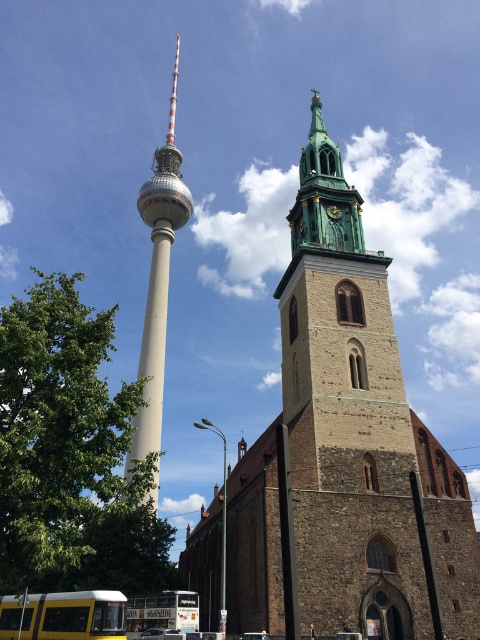
Question: Considering the relative positions of brown stone church at center and white concrete spire at center in the image provided, where is brown stone church at center located with respect to white concrete spire at center?

Choices:
 (A) right
 (B) left

Answer: (A)

Question: Can you confirm if brown stone church at center is thinner than white concrete spire at center?

Choices:
 (A) no
 (B) yes

Answer: (A)

Question: Is brown stone church at center positioned at the back of white concrete spire at center?

Choices:
 (A) yes
 (B) no

Answer: (B)

Question: Which point is farther to the camera?

Choices:
 (A) white concrete spire at center
 (B) brown stone church at center

Answer: (A)

Question: Which point is farther to the camera?

Choices:
 (A) (154, 486)
 (B) (381, 550)

Answer: (A)

Question: Which of the following is the farthest from the observer?

Choices:
 (A) (151, 307)
 (B) (396, 570)

Answer: (A)